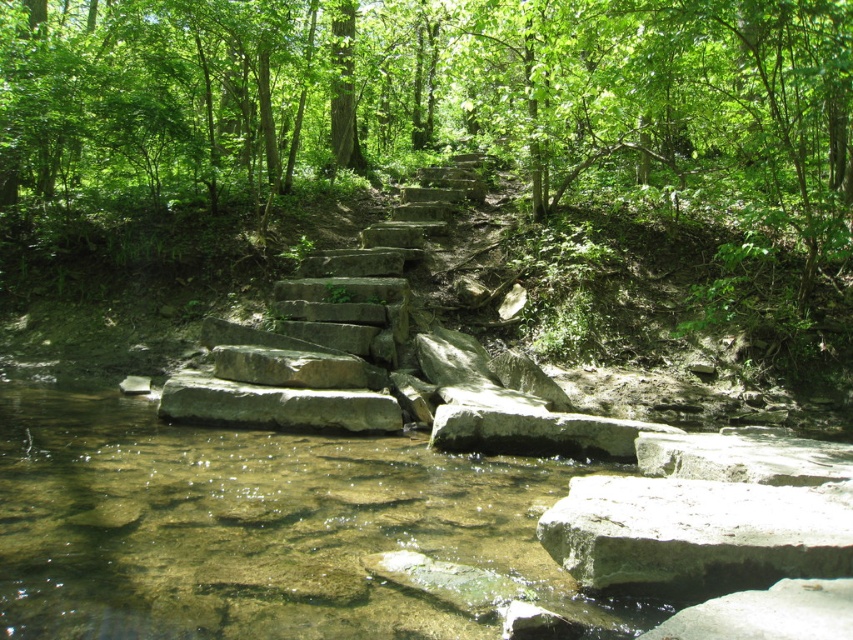
You are standing at the center of the stone steps in the forest scene. You notice two points marked in the image. Which point, point (38, 508) or point (607, 508), is closer to you?

Point (38, 508) is closer to you because it is further to the viewer than point (607, 508).

You are a hiker trying to cross the stream in the image. You see the gray rough rock at lower center and the gray stone boulder at center. Which one is a better stepping stone for you to step on?

The gray rough rock at lower center is smaller than the gray stone boulder at center, so the gray stone boulder at center is a better stepping stone because it provides a larger and more stable surface area for safe crossing.